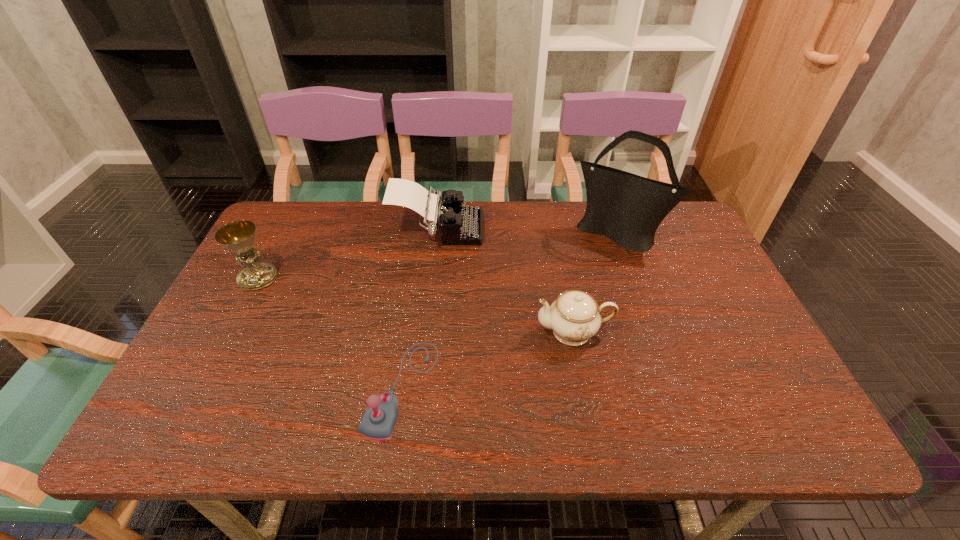
At what (x,y) coordinates should I click in order to perform the action: click on free space between the chinaware and the typewriter. Please return your answer as a coordinate pair (x, y). Looking at the image, I should click on (505, 281).

What are the coordinates of `unoccupied area between the chinaware and the shoulder bag` in the screenshot? It's located at [596, 283].

This screenshot has height=540, width=960. Identify the location of free spot between the typewriter and the chalice. (348, 254).

Find the location of `free point between the joystick and the third farthest object`. free point between the joystick and the third farthest object is located at coordinates (330, 333).

You are a GUI agent. You are given a task and a screenshot of the screen. Output one action in this format:
    pyautogui.click(x=<x>, y=<y>)
    Task: Click on the object that is the second closest to the chinaware
    Image resolution: width=960 pixels, height=540 pixels.
    Given the screenshot: What is the action you would take?
    pyautogui.click(x=627, y=208)

Locate which object is the fourth closest to the third nearest object. Please provide its 2D coordinates. Your answer should be formatted as a tuple, i.e. [(x, y)], where the tuple contains the x and y coordinates of a point satisfying the conditions above.

[(627, 208)]

Identify the location of vacant space that satisfies the following two spatial constraints: 1. on the front side of the shoulder bag; 2. at the spout of the chinaware. pyautogui.click(x=653, y=332).

Image resolution: width=960 pixels, height=540 pixels. I want to click on vacant space that satisfies the following two spatial constraints: 1. on the keys of the tallest object; 2. on the right side of the typewriter, so click(x=437, y=235).

Image resolution: width=960 pixels, height=540 pixels. I want to click on vacant space that satisfies the following two spatial constraints: 1. on the keys of the typewriter; 2. on the left side of the shoulder bag, so click(x=437, y=235).

You are a GUI agent. You are given a task and a screenshot of the screen. Output one action in this format:
    pyautogui.click(x=<x>, y=<y>)
    Task: Click on the vacant area that satisfies the following two spatial constraints: 1. on the keys of the typewriter; 2. on the left side of the shoulder bag
    The height and width of the screenshot is (540, 960).
    Given the screenshot: What is the action you would take?
    pyautogui.click(x=437, y=235)